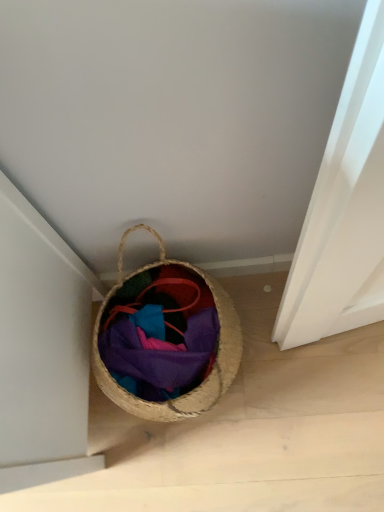
Question: From a real-world perspective, is matte woven basket at center positioned above or below braided straw basket at lower center?

Choices:
 (A) below
 (B) above

Answer: (A)

Question: Is matte woven basket at center inside the boundaries of braided straw basket at lower center, or outside?

Choices:
 (A) inside
 (B) outside

Answer: (A)

Question: Is matte woven basket at center in front of or behind braided straw basket at lower center in the image?

Choices:
 (A) behind
 (B) front

Answer: (A)

Question: Relative to matte woven basket at center, is braided straw basket at lower center in front or behind?

Choices:
 (A) behind
 (B) front

Answer: (B)

Question: Does point (187, 276) appear closer or farther from the camera than point (122, 286)?

Choices:
 (A) closer
 (B) farther

Answer: (A)

Question: In terms of width, does braided straw basket at lower center look wider or thinner when compared to matte woven basket at center?

Choices:
 (A) thin
 (B) wide

Answer: (B)

Question: From a real-world perspective, is braided straw basket at lower center physically located above or below matte woven basket at center?

Choices:
 (A) above
 (B) below

Answer: (A)